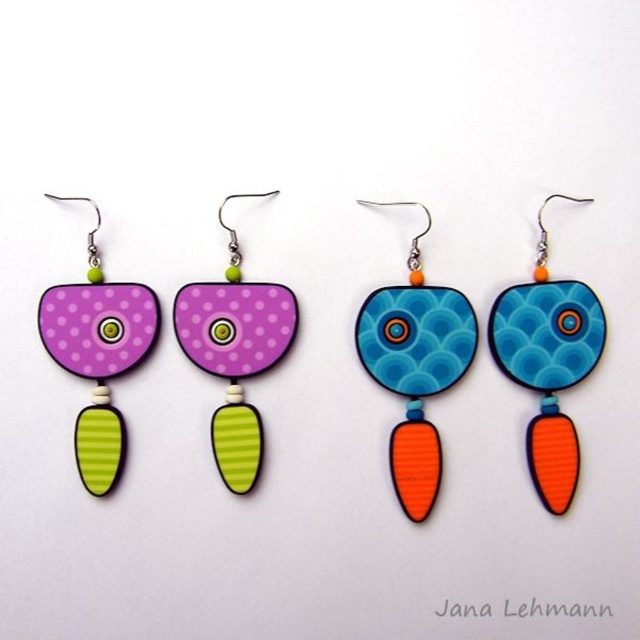
Question: Can you confirm if blue glossy disc at center is positioned to the right of matte purple wood earring at center?

Choices:
 (A) yes
 (B) no

Answer: (A)

Question: From the image, what is the correct spatial relationship of blue glossy disc at center in relation to matte purple wood earring at center?

Choices:
 (A) above
 (B) below

Answer: (B)

Question: Which object is the farthest from the blue glossy disc at center?

Choices:
 (A) blue glossy circle at center
 (B) matte purple wood earring at center
 (C) matte purple wood earring at left

Answer: (C)

Question: Which point is farther to the camera?

Choices:
 (A) blue glossy circle at center
 (B) matte purple wood earring at center
 (C) blue glossy disc at center

Answer: (B)

Question: Does matte purple wood earring at center have a lesser width compared to matte purple wood earring at left?

Choices:
 (A) no
 (B) yes

Answer: (A)

Question: Which object is the farthest from the blue glossy disc at center?

Choices:
 (A) matte purple wood earring at center
 (B) blue glossy circle at center

Answer: (A)